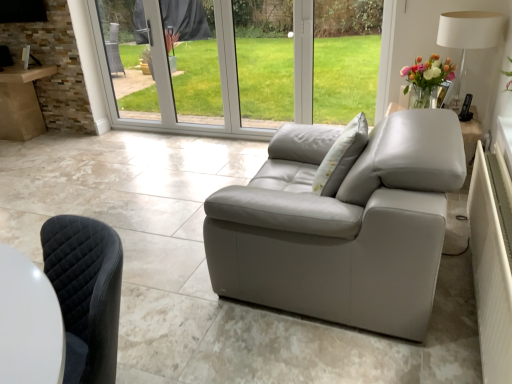
Question: Is light gray fabric pillow at center with white fabric lampshade at upper right?

Choices:
 (A) no
 (B) yes

Answer: (A)

Question: Is the depth of light gray fabric pillow at center less than that of white fabric lampshade at upper right?

Choices:
 (A) yes
 (B) no

Answer: (A)

Question: Is light gray fabric pillow at center at the left side of white fabric lampshade at upper right?

Choices:
 (A) no
 (B) yes

Answer: (B)

Question: From a real-world perspective, is light gray fabric pillow at center positioned over white fabric lampshade at upper right based on gravity?

Choices:
 (A) yes
 (B) no

Answer: (B)

Question: From the image's perspective, is light gray fabric pillow at center on top of white fabric lampshade at upper right?

Choices:
 (A) yes
 (B) no

Answer: (B)

Question: Does light gray fabric pillow at center come behind white fabric lampshade at upper right?

Choices:
 (A) no
 (B) yes

Answer: (A)

Question: Does white fabric lampshade at upper right appear on the left side of light gray fabric pillow at center?

Choices:
 (A) no
 (B) yes

Answer: (A)

Question: Is white fabric lampshade at upper right facing towards light gray fabric pillow at center?

Choices:
 (A) yes
 (B) no

Answer: (B)

Question: Is white fabric lampshade at upper right to the right of light gray fabric pillow at center from the viewer's perspective?

Choices:
 (A) no
 (B) yes

Answer: (B)

Question: Is light gray fabric pillow at center completely or partially inside white fabric lampshade at upper right?

Choices:
 (A) no
 (B) yes

Answer: (A)

Question: Is white fabric lampshade at upper right not inside light gray fabric pillow at center?

Choices:
 (A) yes
 (B) no

Answer: (A)

Question: Is white fabric lampshade at upper right far from light gray fabric pillow at center?

Choices:
 (A) yes
 (B) no

Answer: (A)

Question: Does point (465, 41) appear closer or farther from the camera than point (360, 132)?

Choices:
 (A) closer
 (B) farther

Answer: (B)